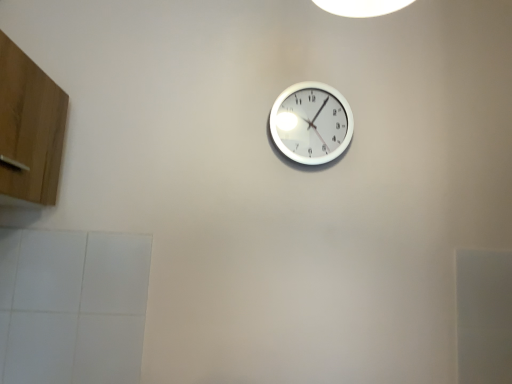
What do you see at coordinates (311, 123) in the screenshot? I see `white plastic wall clock at upper center` at bounding box center [311, 123].

Looking at this image, in order to face white plastic wall clock at upper center, should I rotate leftwards or rightwards?

You should rotate right by 7.499 degrees.

Locate an element on the screen. This screenshot has width=512, height=384. white plastic wall clock at upper center is located at coordinates (311, 123).

At what (x,y) coordinates should I click in order to perform the action: click on white plastic wall clock at upper center. Please return your answer as a coordinate pair (x, y). Looking at the image, I should click on (311, 123).